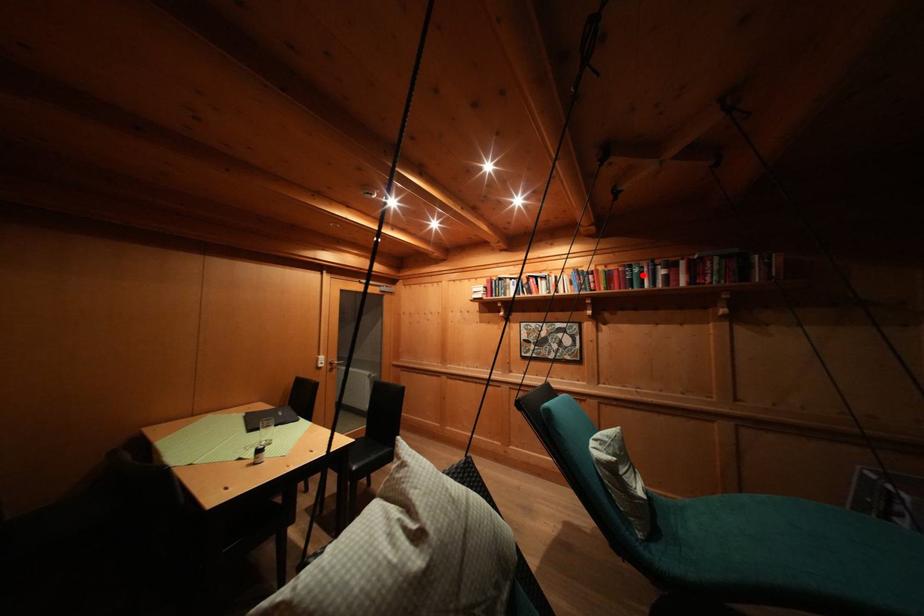
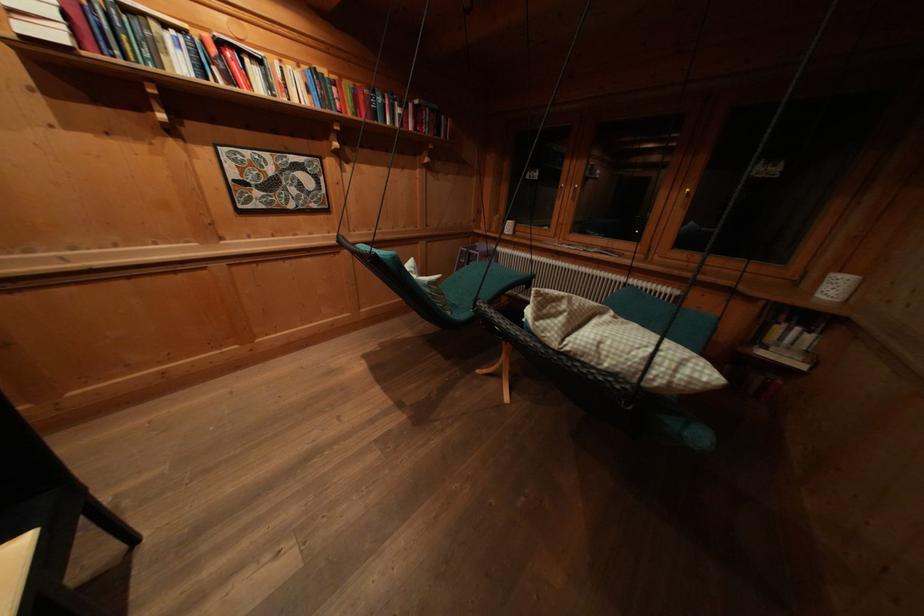
Where in the second image is the point corresponding to the highlighted location from the first image?

(385, 103)